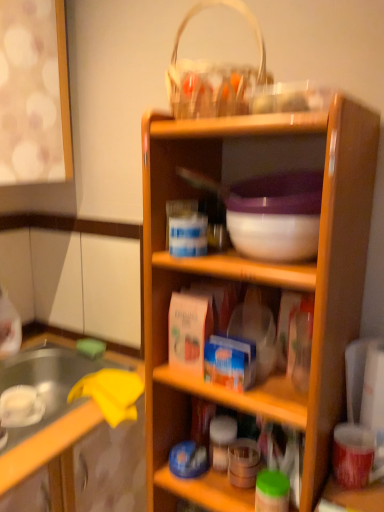
Question: Is white woven basket at upper center facing towards wooden shelf at center?

Choices:
 (A) yes
 (B) no

Answer: (B)

Question: Is white woven basket at upper center far from wooden shelf at center?

Choices:
 (A) no
 (B) yes

Answer: (A)

Question: Considering the relative sizes of white woven basket at upper center and wooden shelf at center in the image provided, is white woven basket at upper center smaller than wooden shelf at center?

Choices:
 (A) no
 (B) yes

Answer: (B)

Question: Is white woven basket at upper center directly adjacent to wooden shelf at center?

Choices:
 (A) no
 (B) yes

Answer: (A)

Question: Does white woven basket at upper center have a lesser width compared to wooden shelf at center?

Choices:
 (A) yes
 (B) no

Answer: (A)

Question: Is white woven basket at upper center shorter than wooden shelf at center?

Choices:
 (A) no
 (B) yes

Answer: (B)

Question: From the image's perspective, does wooden shelf at center appear higher than wooden cabinet at center?

Choices:
 (A) yes
 (B) no

Answer: (A)

Question: Considering the relative positions of wooden shelf at center and wooden cabinet at center in the image provided, is wooden shelf at center to the right of wooden cabinet at center from the viewer's perspective?

Choices:
 (A) no
 (B) yes

Answer: (B)

Question: Is wooden shelf at center next to wooden cabinet at center and touching it?

Choices:
 (A) yes
 (B) no

Answer: (B)

Question: Is wooden shelf at center positioned with its back to wooden cabinet at center?

Choices:
 (A) no
 (B) yes

Answer: (A)

Question: Can you confirm if wooden shelf at center is wider than wooden cabinet at center?

Choices:
 (A) no
 (B) yes

Answer: (A)

Question: Is wooden shelf at center completely or partially outside of wooden cabinet at center?

Choices:
 (A) yes
 (B) no

Answer: (A)

Question: Is wooden shelf at center not within white woven basket at upper center?

Choices:
 (A) no
 (B) yes

Answer: (B)